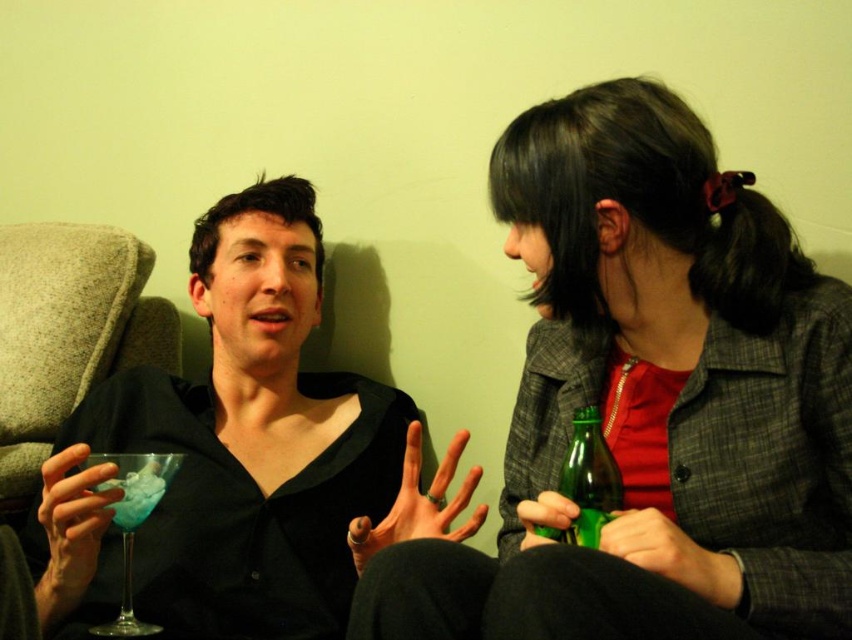
Question: Does matte black shirt at left come in front of translucent glass at left?

Choices:
 (A) yes
 (B) no

Answer: (A)

Question: Based on their relative distances, which object is farther from the matte black shirt at left?

Choices:
 (A) plaid fabric jacket at center
 (B) green glass bottle at right
 (C) translucent blue glass at left
 (D) translucent glass at left

Answer: (B)

Question: Does plaid fabric jacket at center appear on the left side of translucent glass at left?

Choices:
 (A) no
 (B) yes

Answer: (A)

Question: Which of the following is the closest to the observer?

Choices:
 (A) (199, 269)
 (B) (125, 508)

Answer: (B)

Question: Can you confirm if matte black shirt at left is smaller than green glass bottle at right?

Choices:
 (A) no
 (B) yes

Answer: (A)

Question: Estimate the real-world distances between objects in this image. Which object is farther from the matte black shirt at left?

Choices:
 (A) plaid fabric jacket at center
 (B) green glass bottle at right
 (C) translucent blue glass at left
 (D) translucent glass at left

Answer: (B)